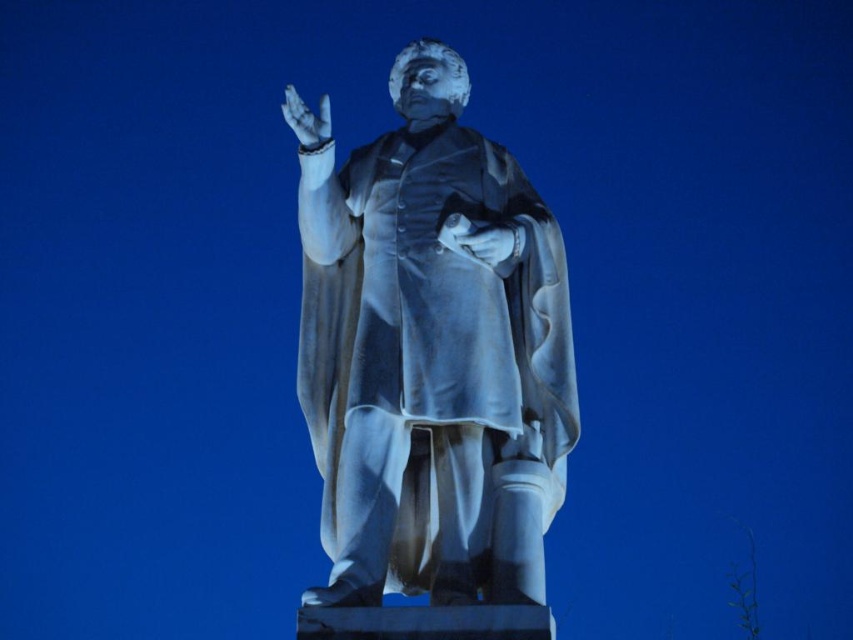
Question: Is white marble statue at center positioned at the back of white marble hand at upper center?

Choices:
 (A) yes
 (B) no

Answer: (B)

Question: Is white marble statue at center further to the viewer compared to white marble glove at center?

Choices:
 (A) yes
 (B) no

Answer: (B)

Question: Among these points, which one is farthest from the camera?

Choices:
 (A) (462, 246)
 (B) (430, 433)

Answer: (A)

Question: Observing the image, what is the correct spatial positioning of white marble glove at center in reference to white marble hand at upper center?

Choices:
 (A) left
 (B) right

Answer: (B)

Question: Which point is farther from the camera taking this photo?

Choices:
 (A) (480, 250)
 (B) (308, 129)

Answer: (B)

Question: Which object appears farthest from the camera in this image?

Choices:
 (A) white marble hand at upper center
 (B) white marble glove at center
 (C) white marble statue at center

Answer: (A)